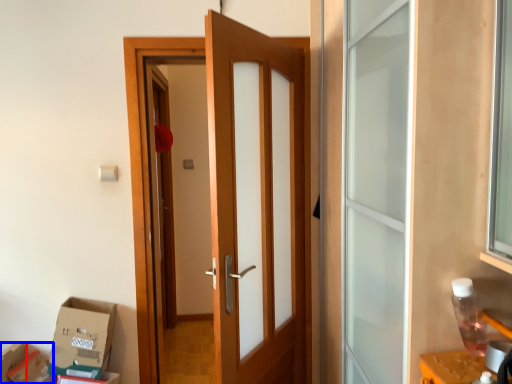
Question: Which object is further to the camera taking this photo, box (highlighted by a red box) or cardboard box (highlighted by a blue box)?

Choices:
 (A) box
 (B) cardboard box

Answer: (B)